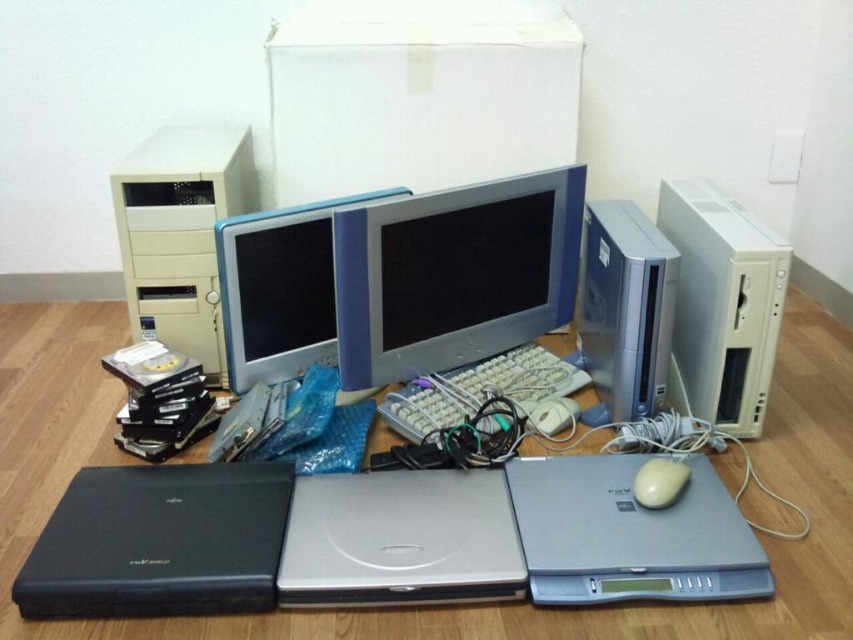
Question: Which point is farther to the camera?

Choices:
 (A) (433, 364)
 (B) (647, 525)
 (C) (212, 502)

Answer: (A)

Question: Considering the real-world distances, which object is farthest from the matte silver monitor at center?

Choices:
 (A) white matte mouse at center
 (B) matte plastic monitor at center
 (C) black matte laptop at lower left

Answer: (A)

Question: Does matte silver monitor at center have a lesser width compared to white plastic keyboard at center?

Choices:
 (A) yes
 (B) no

Answer: (B)

Question: Does matte silver monitor at center have a smaller size compared to satin silver desktop at center?

Choices:
 (A) yes
 (B) no

Answer: (B)

Question: Is silver metallic laptop at center to the right of matte plastic monitor at center from the viewer's perspective?

Choices:
 (A) no
 (B) yes

Answer: (B)

Question: Which point appears closest to the camera in this image?

Choices:
 (A) (564, 561)
 (B) (671, 378)

Answer: (A)